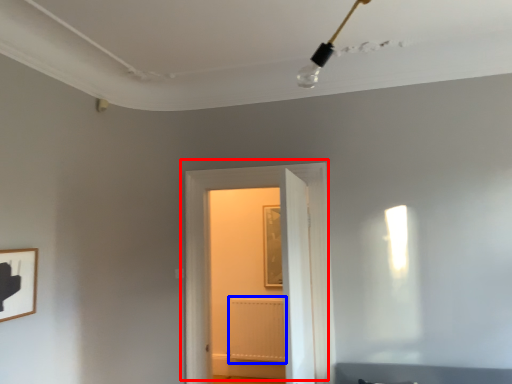
Question: Which point is closer to the camera, door (highlighted by a red box) or radiator (highlighted by a blue box)?

Choices:
 (A) door
 (B) radiator

Answer: (A)